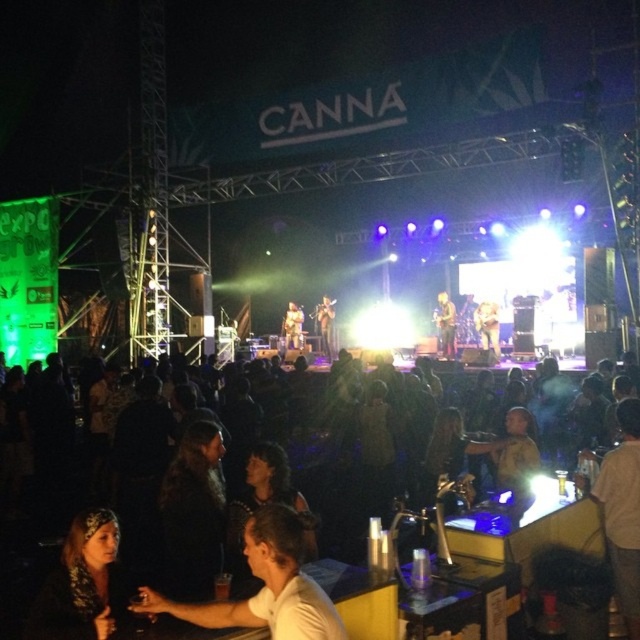
You are a photographer at the concert and want to capture both the smooth wooden guitar at center and the shiny gold guitar at center in a single shot. Which guitar is positioned lower in the frame?

The smooth wooden guitar at center is positioned below the shiny gold guitar at center, so it is lower in the frame.